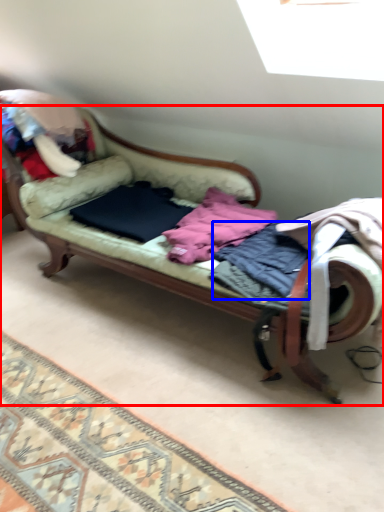
Question: Among these objects, which one is farthest to the camera, studio couch (highlighted by a red box) or clothing (highlighted by a blue box)?

Choices:
 (A) studio couch
 (B) clothing

Answer: (B)